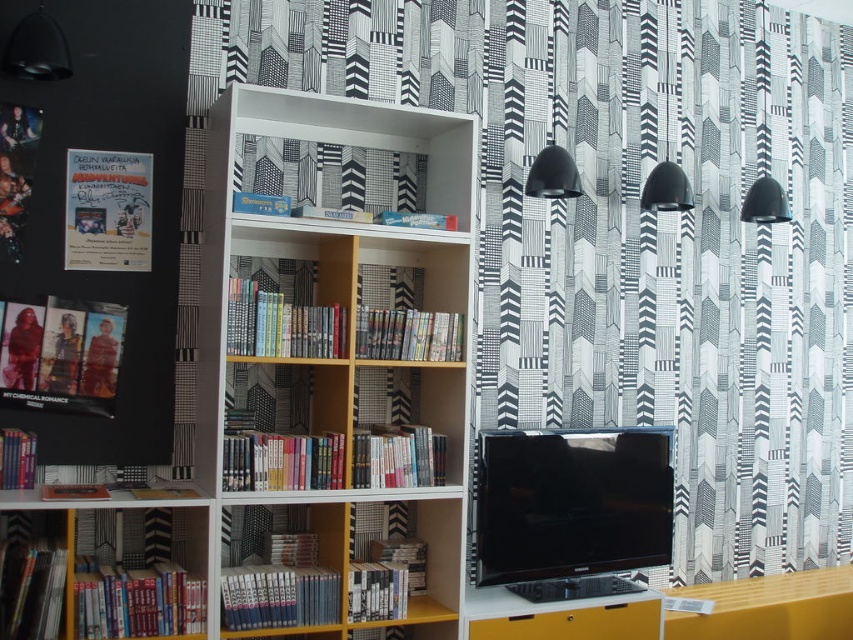
Which is above, black and white patterned curtain at upper center or white wood bookshelf at center?

black and white patterned curtain at upper center is higher up.

Can you confirm if black and white patterned curtain at upper center is smaller than white wood bookshelf at center?

No.

This screenshot has height=640, width=853. Describe the element at coordinates (627, 228) in the screenshot. I see `black and white patterned curtain at upper center` at that location.

Identify the location of black and white patterned curtain at upper center. The width and height of the screenshot is (853, 640). (627, 228).